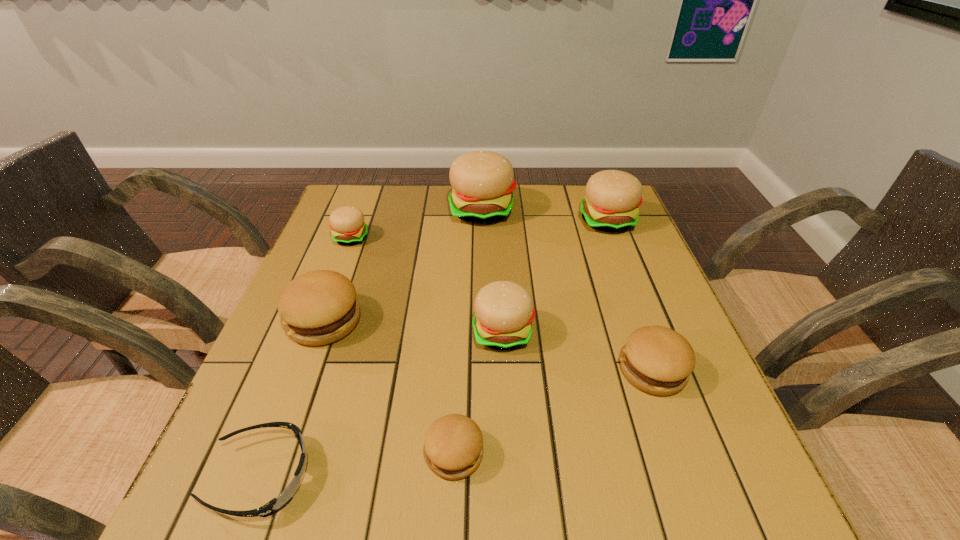
Image resolution: width=960 pixels, height=540 pixels. In order to click on hamburger that is the nearest to the biggest brown hamburger in this screenshot , I will do `click(347, 225)`.

Select which hamburger appears as the fourth closest to the second biggest beige hamburger. Please provide its 2D coordinates. Your answer should be formatted as a tuple, i.e. [(x, y)], where the tuple contains the x and y coordinates of a point satisfying the conditions above.

[(347, 225)]

Find the location of a particular element. The height and width of the screenshot is (540, 960). beige hamburger identified as the closest to the second tallest hamburger is located at coordinates (482, 182).

Image resolution: width=960 pixels, height=540 pixels. In order to click on the second closest beige hamburger to the leftmost beige hamburger in this screenshot , I will do `click(504, 312)`.

Choose which brown hamburger is the nearest neighbor to the biggest brown hamburger. Please provide its 2D coordinates. Your answer should be formatted as a tuple, i.e. [(x, y)], where the tuple contains the x and y coordinates of a point satisfying the conditions above.

[(453, 444)]

Identify which brown hamburger is the third nearest to the third biggest beige hamburger. Please provide its 2D coordinates. Your answer should be formatted as a tuple, i.e. [(x, y)], where the tuple contains the x and y coordinates of a point satisfying the conditions above.

[(319, 307)]

In order to click on free space that satisfies the following two spatial constraints: 1. on the back side of the second smallest beige hamburger; 2. on the right side of the nearest brown hamburger in this screenshot , I will do `click(460, 332)`.

Where is `free space that satisfies the following two spatial constraints: 1. on the front side of the smallest beige hamburger; 2. on the left side of the nearest beige hamburger`? The height and width of the screenshot is (540, 960). free space that satisfies the following two spatial constraints: 1. on the front side of the smallest beige hamburger; 2. on the left side of the nearest beige hamburger is located at coordinates (316, 332).